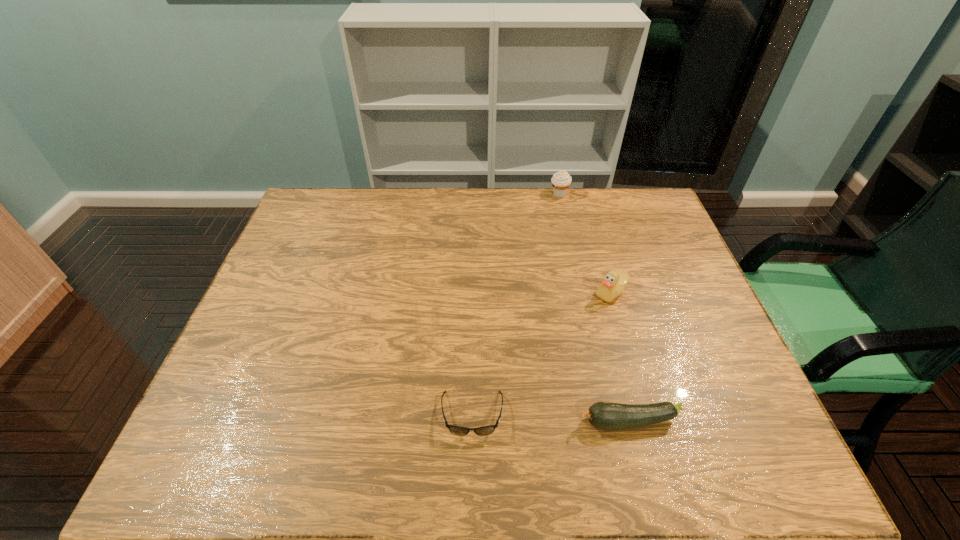
I want to click on muffin, so click(561, 180).

At what (x,y) coordinates should I click in order to perform the action: click on the third nearest object. Please return your answer as a coordinate pair (x, y). This screenshot has height=540, width=960. Looking at the image, I should click on (613, 284).

The width and height of the screenshot is (960, 540). I want to click on the third tallest object, so click(x=603, y=415).

You are a GUI agent. You are given a task and a screenshot of the screen. Output one action in this format:
    pyautogui.click(x=<x>, y=<y>)
    Task: Click on the sunglasses
    Image resolution: width=960 pixels, height=540 pixels.
    Given the screenshot: What is the action you would take?
    pyautogui.click(x=456, y=430)

You are a GUI agent. You are given a task and a screenshot of the screen. Output one action in this format:
    pyautogui.click(x=<x>, y=<y>)
    Task: Click on the leftmost object
    
    Given the screenshot: What is the action you would take?
    pyautogui.click(x=456, y=430)

The width and height of the screenshot is (960, 540). Identify the location of blank area located 0.390m on the front of the muffin. (578, 278).

This screenshot has height=540, width=960. I want to click on free location located at the beak of the second farthest object, so click(568, 293).

Find the location of a particular element. vacant space situated at the beak of the second farthest object is located at coordinates (526, 293).

Locate an element on the screen. This screenshot has height=540, width=960. free space located 0.100m at the beak of the second farthest object is located at coordinates (558, 293).

At what (x,y) coordinates should I click in order to perform the action: click on free space located at the blossom end of the zucchini. Please return your answer as a coordinate pair (x, y). The width and height of the screenshot is (960, 540). Looking at the image, I should click on (431, 422).